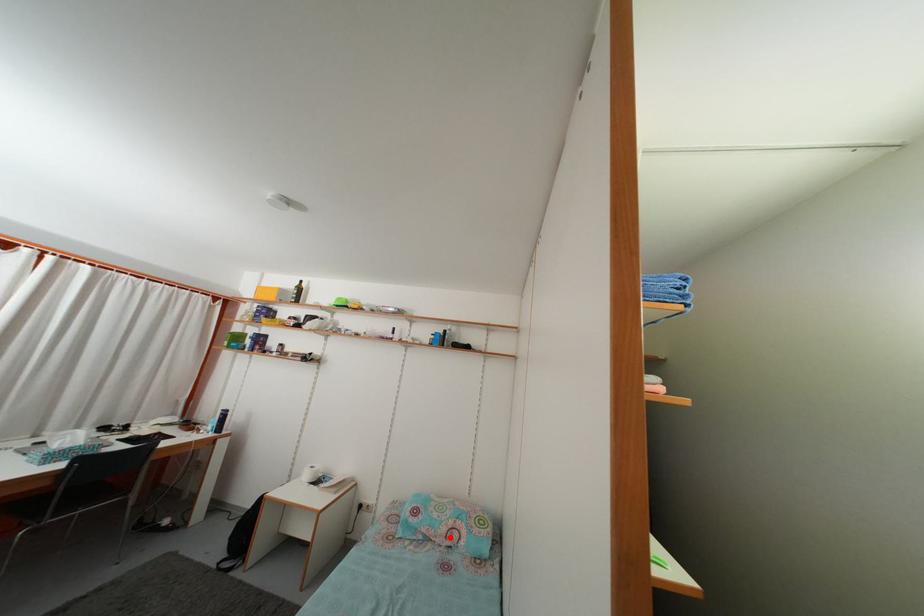
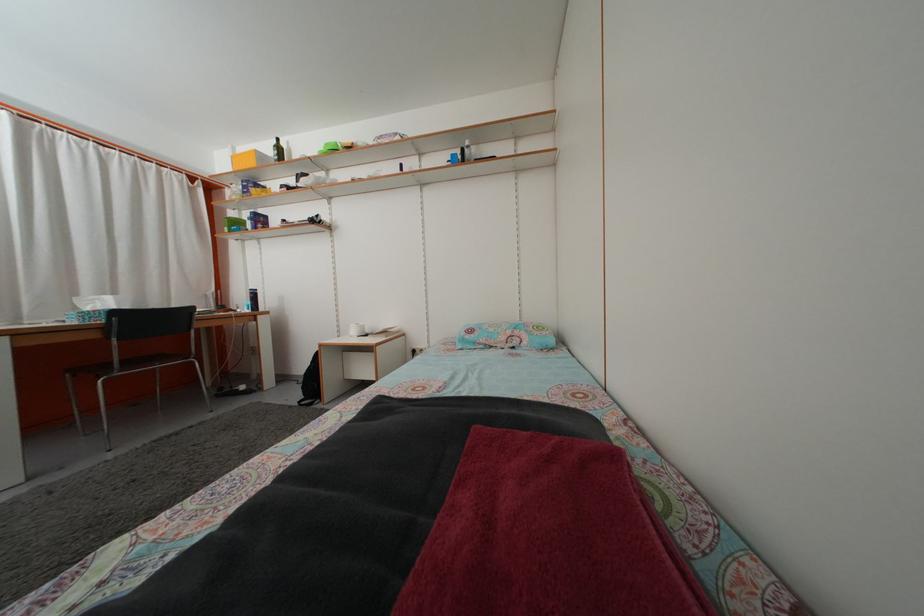
In the second image, find the point that corresponds to the highlighted location in the first image.

(508, 346)